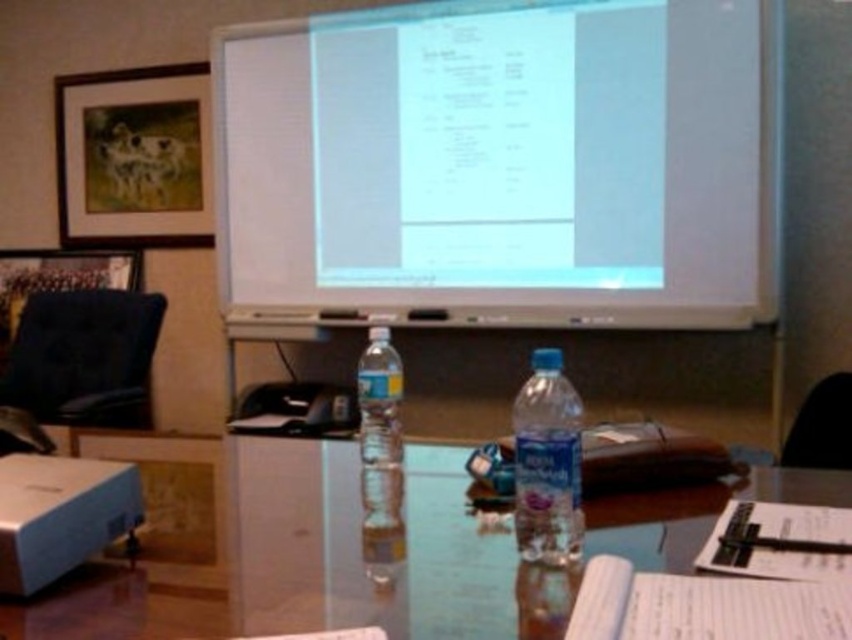
Question: Is transparent glass table at center closer to the viewer compared to matte wooden picture frame at upper left?

Choices:
 (A) no
 (B) yes

Answer: (B)

Question: Which of the following is the farthest from the observer?

Choices:
 (A) (0, 540)
 (B) (68, 144)

Answer: (B)

Question: Is white glossy projector screen at upper center wider than transparent glass table at center?

Choices:
 (A) yes
 (B) no

Answer: (A)

Question: Which is nearer to the clear plastic bottle at center?

Choices:
 (A) matte wooden picture frame at upper left
 (B) transparent glass table at center
 (C) white glossy projector screen at upper center

Answer: (B)

Question: Which object is positioned closest to the clear plastic water bottle at center?

Choices:
 (A) matte wooden picture frame at upper left
 (B) matte gray projector at lower left
 (C) clear plastic bottle at center
 (D) translucent plastic water bottle at center

Answer: (C)

Question: Does matte wooden picture frame at upper left have a lesser width compared to matte gray projector at lower left?

Choices:
 (A) yes
 (B) no

Answer: (B)